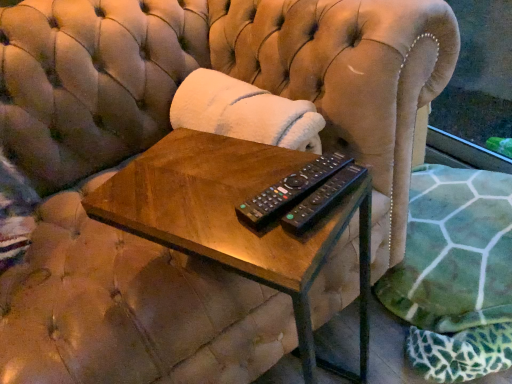
Question: Is black plastic remote at center, which appears as the 2th remote control when viewed from the front, bigger or smaller than black plastic remote at center, the first remote control positioned from the front?

Choices:
 (A) big
 (B) small

Answer: (A)

Question: From a real-world perspective, is black plastic remote at center, the first remote control from the back, positioned above or below black plastic remote at center, the first remote control positioned from the front?

Choices:
 (A) below
 (B) above

Answer: (A)

Question: Which of these objects is positioned farthest from the black plastic remote at center, the second remote control viewed from the back?

Choices:
 (A) woodenmaterial/texturetable at center
 (B) black plastic remote at center, the first remote control from the back

Answer: (A)

Question: Which object is the farthest from the woodenmaterial/texturetable at center?

Choices:
 (A) black plastic remote at center, the first remote control positioned from the front
 (B) black plastic remote at center, the first remote control from the back

Answer: (A)